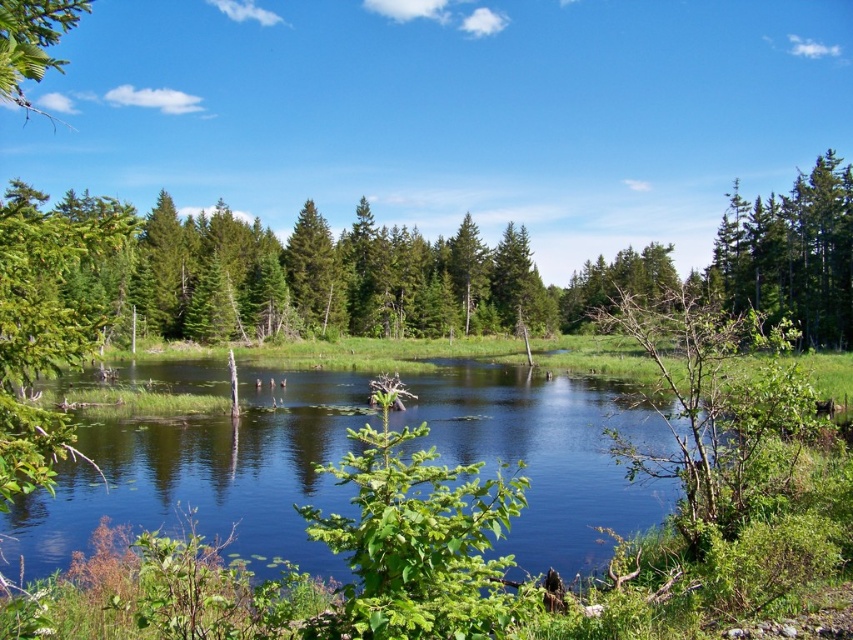
Between clear water at center and green matte tree at upper right, which one has less height?

clear water at center

Who is positioned more to the left, clear water at center or green matte tree at upper right?

Positioned to the left is clear water at center.

Is point (488, 364) farther from camera compared to point (776, 204)?

Yes, it is.

Find the location of `clear water at center`. clear water at center is located at coordinates coord(206,474).

Between clear water at center and green matte tree at center, which one has less height?

clear water at center

Who is more forward, (520, 573) or (321, 216)?

Point (520, 573) is in front.

The image size is (853, 640). I want to click on clear water at center, so click(x=206, y=474).

This screenshot has height=640, width=853. Describe the element at coordinates (791, 253) in the screenshot. I see `green matte tree at upper right` at that location.

Measure the distance between green matte tree at upper right and camera.

green matte tree at upper right and camera are 171.88 feet apart from each other.

Describe the element at coordinates (791, 253) in the screenshot. I see `green matte tree at upper right` at that location.

This screenshot has height=640, width=853. I want to click on green matte tree at upper right, so (x=791, y=253).